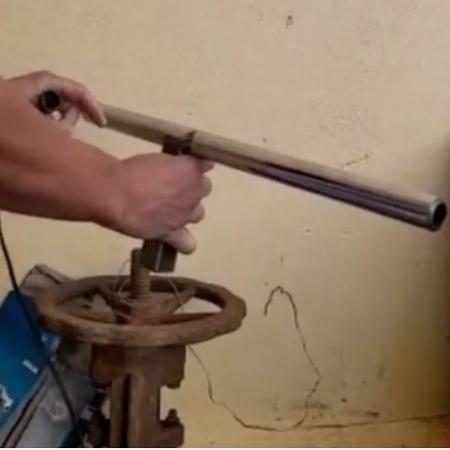
Locate an element on the screen. This screenshot has width=450, height=450. wall is located at coordinates (315, 81).